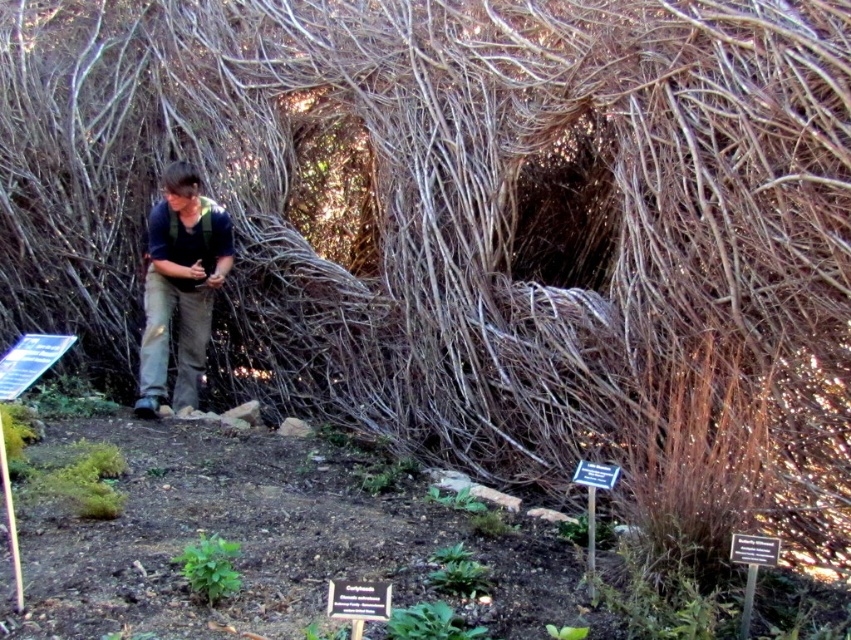
Question: Does brown cotton pants at center appear on the right side of green leafy plant at lower left?

Choices:
 (A) yes
 (B) no

Answer: (B)

Question: Among these points, which one is farthest from the camera?

Choices:
 (A) (191, 550)
 (B) (170, 236)

Answer: (B)

Question: Which object appears farthest from the camera in this image?

Choices:
 (A) green leafy plant at lower center
 (B) green leafy plant at lower left
 (C) brown cotton pants at center

Answer: (C)

Question: Can you confirm if green leafy plant at lower left is positioned above green leafy plant at lower center?

Choices:
 (A) yes
 (B) no

Answer: (A)

Question: Can you confirm if green leafy plant at lower left is positioned above green leafy plant at lower center?

Choices:
 (A) no
 (B) yes

Answer: (B)

Question: Which of these objects is positioned farthest from the brown cotton pants at center?

Choices:
 (A) green leafy plant at lower left
 (B) green leafy plant at lower center

Answer: (B)